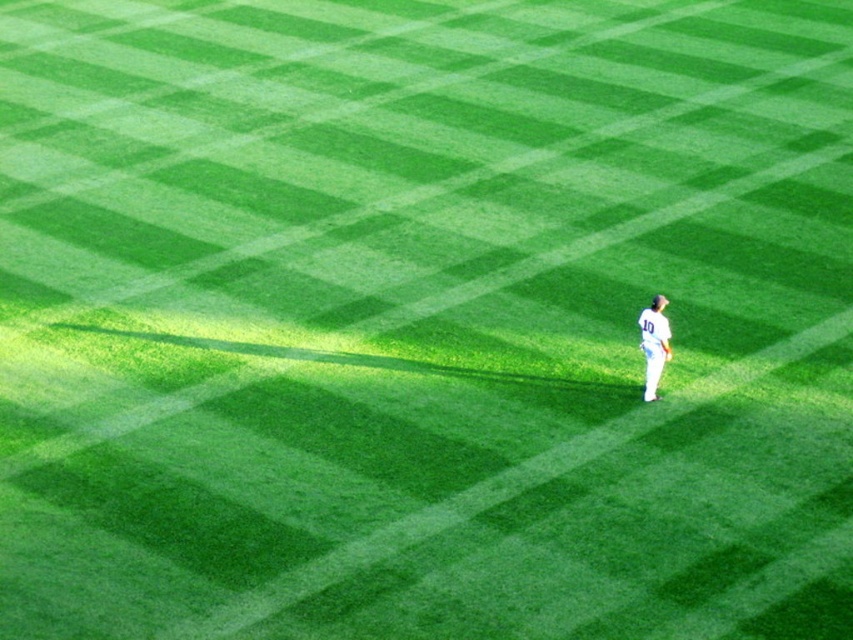
Question: Among these points, which one is farthest from the camera?

Choices:
 (A) (669, 349)
 (B) (657, 330)

Answer: (A)

Question: From the image, what is the correct spatial relationship of white jersey at right in relation to white fabric baseball glove at center-right?

Choices:
 (A) below
 (B) above

Answer: (B)

Question: Is white jersey at right positioned before white fabric baseball glove at center-right?

Choices:
 (A) yes
 (B) no

Answer: (A)

Question: Where is white jersey at right located in relation to white fabric baseball glove at center-right in the image?

Choices:
 (A) above
 (B) below

Answer: (A)